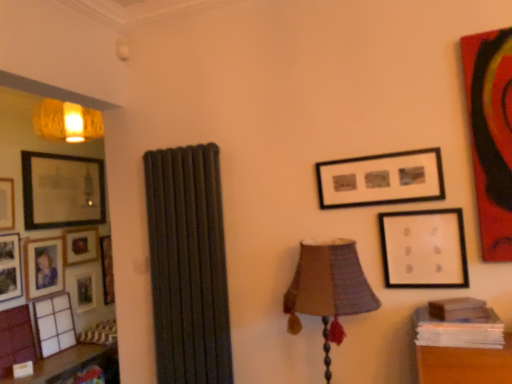
Question: From the image's perspective, is wooden table at left positioned above or below matte black picture frame at left, the fifth picture frame from the front?

Choices:
 (A) above
 (B) below

Answer: (B)

Question: Is wooden table at left bigger or smaller than matte black picture frame at left, the 4th picture frame viewed from the back?

Choices:
 (A) small
 (B) big

Answer: (B)

Question: Which object is positioned closest to the wooden table at left?

Choices:
 (A) matte wooden picture frame at left, the 8th picture frame positioned from the front
 (B) matte black picture frame at upper right, which is the 7th picture frame in left-to-right order
 (C) matte glass picture frame at left, the sixth picture frame in the front-to-back sequence
 (D) matte gold picture frame at left, placed as the 7th picture frame when sorted from front to back
 (E) matte black picture frame at left, the 4th picture frame viewed from the back

Answer: (A)

Question: Which of these objects is positioned farthest from the matte gold picture frame at left, which is the second picture frame in back-to-front order?

Choices:
 (A) wooden table at left
 (B) matte glass picture frame at left, the sixth picture frame in the front-to-back sequence
 (C) matte black picture frame at upper right, which ranks as the 2th picture frame in right-to-left order
 (D) matte black picture frame at left, which ranks as the 1th picture frame in left-to-right order
 (E) matte black picture frame at left, which is the 5th picture frame in right-to-left order

Answer: (C)